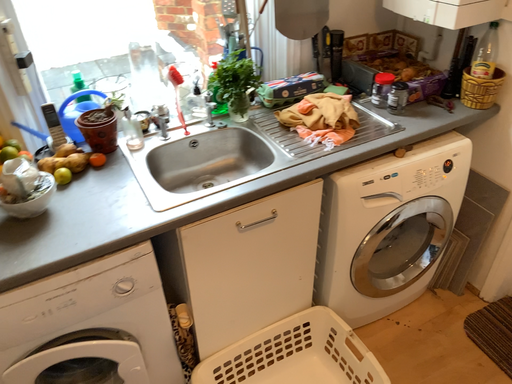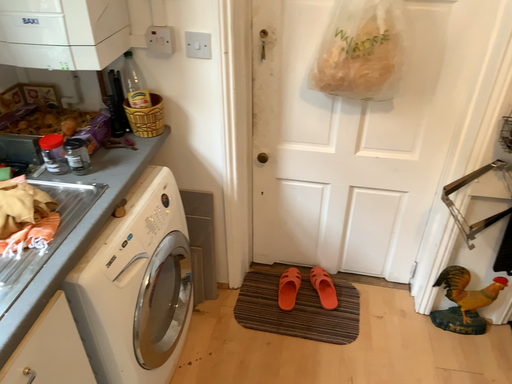
Question: How did the camera likely rotate when shooting the video?

Choices:
 (A) rotated downward
 (B) rotated upward

Answer: (B)